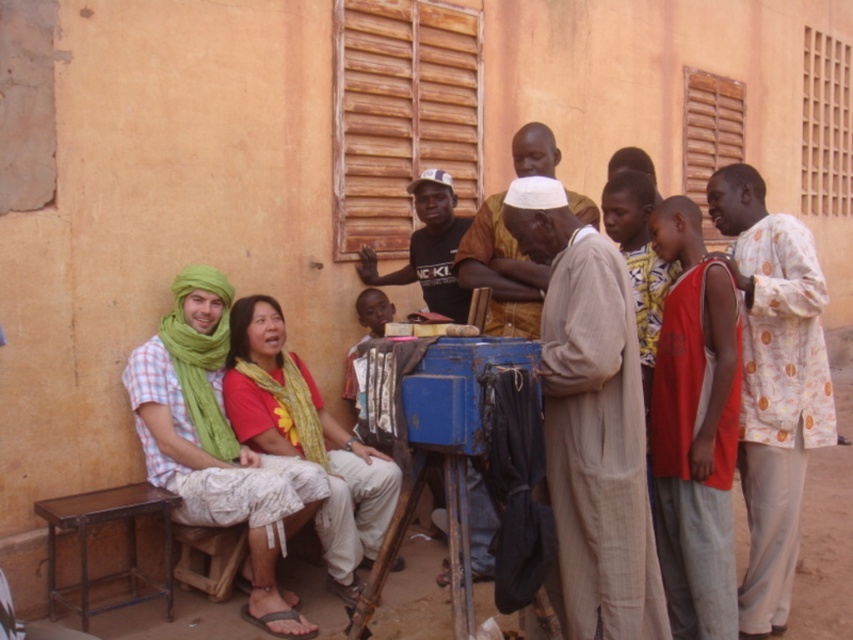
You are standing in front of the building and notice two items in the scene. The first is a red sleeveless shirt at right and the second is a yellow printed fabric at center. Which item is taller?

The red sleeveless shirt at right is taller than the yellow printed fabric at center.

You are an interior designer assessing the space in the image. You need to determine if a new decorative item that requires a height of 1 meter can be placed on the wooden stool at lower left. Based on the height of the red sleeveless shirt at right, can you estimate whether the stool is tall enough?

The red sleeveless shirt at right is taller than the wooden stool at lower left. Since the shirt is taller than the stool, and the required height for the decorative item is 1 meter, it is uncertain if the stool meets the requirement without knowing the exact height of the shirt.

You are trying to decide whether to place a narrow decorative item on the red sleeveless shirt at right or the wooden stool at lower left. Based on their widths, which object would be more suitable as a stable base?

The wooden stool at lower left is wider than the red sleeveless shirt at right, so it would provide a more stable base for the narrow decorative item.